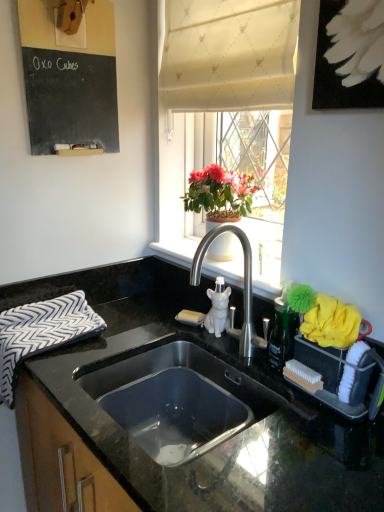
Describe the element at coordinates (265, 275) in the screenshot. The width and height of the screenshot is (384, 512). I see `white ceramic window sill at upper center` at that location.

The height and width of the screenshot is (512, 384). What do you see at coordinates (219, 195) in the screenshot? I see `green leafy plant at upper center` at bounding box center [219, 195].

The image size is (384, 512). What do you see at coordinates (229, 54) in the screenshot? I see `white textured curtain at upper center` at bounding box center [229, 54].

Image resolution: width=384 pixels, height=512 pixels. Identify the location of black granite countertop at center. (159, 442).

Measure the distance between white fabric at upper center and camera.

The depth of white fabric at upper center is 38.99 inches.

Locate an element on the screen. white ceramic window sill at upper center is located at coordinates (265, 275).

Can you tell me how much white textured curtain at upper center and green leafy plant at upper center differ in facing direction?

0.775 degrees.

Does white textured curtain at upper center turn towards green leafy plant at upper center?

No, white textured curtain at upper center is not aimed at green leafy plant at upper center.

Which of these two, white textured curtain at upper center or green leafy plant at upper center, is thinner?

Thinner between the two is white textured curtain at upper center.

Is there a large distance between white textured curtain at upper center and green leafy plant at upper center?

They are positioned close to each other.

Would you say green leafy plant at upper center is outside black chalkboard at upper left?

That's correct, green leafy plant at upper center is outside of black chalkboard at upper left.

Considering their positions, is green leafy plant at upper center located in front of or behind black chalkboard at upper left?

green leafy plant at upper center is behind black chalkboard at upper left.

Can you confirm if green leafy plant at upper center is shorter than black chalkboard at upper left?

Correct, green leafy plant at upper center is not as tall as black chalkboard at upper left.

From a real-world perspective, is green leafy plant at upper center on top of black chalkboard at upper left?

Actually, green leafy plant at upper center is physically below black chalkboard at upper left in the real world.

Is black and white zigzag fabric hand towel at left turned away from black granite countertop at center?

That's right, black and white zigzag fabric hand towel at left is facing away from black granite countertop at center.

Is the depth of black and white zigzag fabric hand towel at left less than that of black granite countertop at center?

No, it is behind black granite countertop at center.

Is black granite countertop at center completely or partially inside black and white zigzag fabric hand towel at left?

No, black granite countertop at center is located outside of black and white zigzag fabric hand towel at left.

In terms of size, does black and white zigzag fabric hand towel at left appear bigger or smaller than black granite countertop at center?

black and white zigzag fabric hand towel at left is smaller than black granite countertop at center.

Can you confirm if black chalkboard at upper left is wider than black and white zigzag fabric hand towel at left?

No, black chalkboard at upper left is not wider than black and white zigzag fabric hand towel at left.

From a real-world perspective, is black chalkboard at upper left physically located above or below black and white zigzag fabric hand towel at left?

From a real-world perspective, black chalkboard at upper left is physically above black and white zigzag fabric hand towel at left.

Could you measure the distance between black chalkboard at upper left and black and white zigzag fabric hand towel at left?

black chalkboard at upper left and black and white zigzag fabric hand towel at left are 24.46 inches apart.

Considering the relative positions of black chalkboard at upper left and black and white zigzag fabric hand towel at left in the image provided, is black chalkboard at upper left in front of black and white zigzag fabric hand towel at left?

No, black chalkboard at upper left is further to the viewer.

Can you confirm if black chalkboard at upper left is taller than white textured curtain at upper center?

Indeed, black chalkboard at upper left has a greater height compared to white textured curtain at upper center.

In the scene shown: Is black chalkboard at upper left positioned behind white textured curtain at upper center?

That is True.

Can you confirm if black chalkboard at upper left is thinner than white textured curtain at upper center?

Incorrect, the width of black chalkboard at upper left is not less than that of white textured curtain at upper center.

Is black granite countertop at center not near white ceramic window sill at upper center?

black granite countertop at center is near white ceramic window sill at upper center, not far away.

Choose the correct answer: Is black granite countertop at center inside white ceramic window sill at upper center or outside it?

black granite countertop at center cannot be found inside white ceramic window sill at upper center.

From a real-world perspective, is black granite countertop at center above or below white ceramic window sill at upper center?

black granite countertop at center is situated lower than white ceramic window sill at upper center in the real world.

Is black granite countertop at center facing towards white ceramic window sill at upper center?

No, black granite countertop at center is not oriented towards white ceramic window sill at upper center.

Between black granite countertop at center and black and white zigzag fabric hand towel at left, which one has smaller width?

Thinner between the two is black and white zigzag fabric hand towel at left.

Considering the relative positions of black granite countertop at center and black and white zigzag fabric hand towel at left in the image provided, is black granite countertop at center to the left of black and white zigzag fabric hand towel at left from the viewer's perspective?

No.

Are black granite countertop at center and black and white zigzag fabric hand towel at left far apart?

No, there isn't a large distance between black granite countertop at center and black and white zigzag fabric hand towel at left.

Where is `curtain located on the left of green leafy plant at upper center`? The width and height of the screenshot is (384, 512). curtain located on the left of green leafy plant at upper center is located at coordinates [x=229, y=54].

In the image, there is a black chalkboard at upper left. At what (x,y) coordinates should I click in order to perform the action: click on houseplant below it (from the image's perspective). Please return your answer as a coordinate pair (x, y). Looking at the image, I should click on (219, 195).

Estimate the real-world distances between objects in this image. Which object is closer to white ceramic window sill at upper center, black and white zigzag fabric hand towel at left or black chalkboard at upper left?

Based on the image, black and white zigzag fabric hand towel at left appears to be nearer to white ceramic window sill at upper center.

When comparing their distances from white ceramic window sill at upper center, does white fabric at upper center or black chalkboard at upper left seem further?

black chalkboard at upper left lies further to white ceramic window sill at upper center than the other object.

Looking at the image, which one is located further to white textured curtain at upper center, white ceramic window sill at upper center or white fabric at upper center?

Based on the image, white ceramic window sill at upper center appears to be further to white textured curtain at upper center.

In the scene shown: Based on their spatial positions, is black and white zigzag fabric hand towel at left or white textured curtain at upper center further from white ceramic window sill at upper center?

white textured curtain at upper center lies further to white ceramic window sill at upper center than the other object.

From the image, which object appears to be farther from black and white zigzag fabric hand towel at left, green leafy plant at upper center or white fabric at upper center?

white fabric at upper center lies further to black and white zigzag fabric hand towel at left than the other object.

When comparing their distances from green leafy plant at upper center, does black and white zigzag fabric hand towel at left or white ceramic window sill at upper center seem closer?

white ceramic window sill at upper center.

In the scene shown: Estimate the real-world distances between objects in this image. Which object is closer to green leafy plant at upper center, black chalkboard at upper left or white textured curtain at upper center?

Among the two, white textured curtain at upper center is located nearer to green leafy plant at upper center.

When comparing their distances from black chalkboard at upper left, does white ceramic window sill at upper center or black granite countertop at center seem further?

The object further to black chalkboard at upper left is black granite countertop at center.

Where is `hand towel between white textured curtain at upper center and black granite countertop at center vertically`? hand towel between white textured curtain at upper center and black granite countertop at center vertically is located at coordinates (42, 332).

Identify the location of window between white textured curtain at upper center and black granite countertop at center vertically. The height and width of the screenshot is (512, 384). (226, 116).

You are a GUI agent. You are given a task and a screenshot of the screen. Output one action in this format:
    pyautogui.click(x=<x>, y=<y>)
    Task: Click on the houseplant between white fabric at upper center and black and white zigzag fabric hand towel at left in the up-down direction
    This screenshot has height=512, width=384.
    Given the screenshot: What is the action you would take?
    pyautogui.click(x=219, y=195)

Locate an element on the screen. houseplant between white fabric at upper center and black granite countertop at center in the up-down direction is located at coordinates (219, 195).